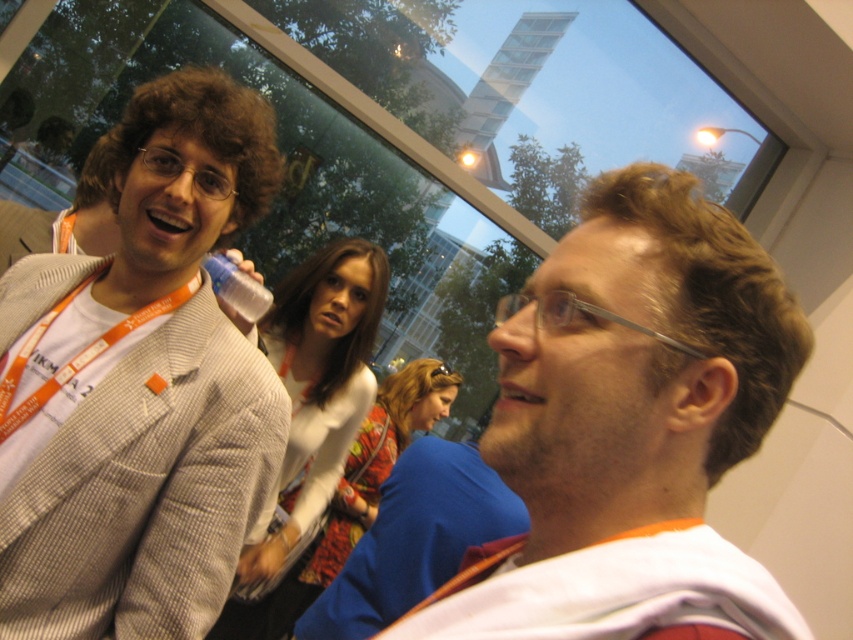
Who is positioned more to the left, smooth orange hoodie at right or white sweater at center?

white sweater at center is more to the left.

Between smooth orange hoodie at right and white sweater at center, which one has less height?

With less height is smooth orange hoodie at right.

Is point (611, 227) farther from camera compared to point (273, 545)?

No.

The image size is (853, 640). Identify the location of smooth orange hoodie at right. (630, 428).

Who is higher up, white sweater at center or floral fabric dress at center?

Positioned higher is white sweater at center.

Can you confirm if white sweater at center is positioned to the left of floral fabric dress at center?

Correct, you'll find white sweater at center to the left of floral fabric dress at center.

Is point (262, 321) positioned behind point (340, 516)?

No.

Where is `white sweater at center`? white sweater at center is located at coordinates (318, 381).

Does smooth orange hoodie at right appear on the left side of gray checkered blazer at left?

In fact, smooth orange hoodie at right is to the right of gray checkered blazer at left.

Is the position of smooth orange hoodie at right more distant than that of gray checkered blazer at left?

No, smooth orange hoodie at right is in front of gray checkered blazer at left.

Image resolution: width=853 pixels, height=640 pixels. I want to click on smooth orange hoodie at right, so click(x=630, y=428).

Find the location of a particular element. The height and width of the screenshot is (640, 853). smooth orange hoodie at right is located at coordinates (630, 428).